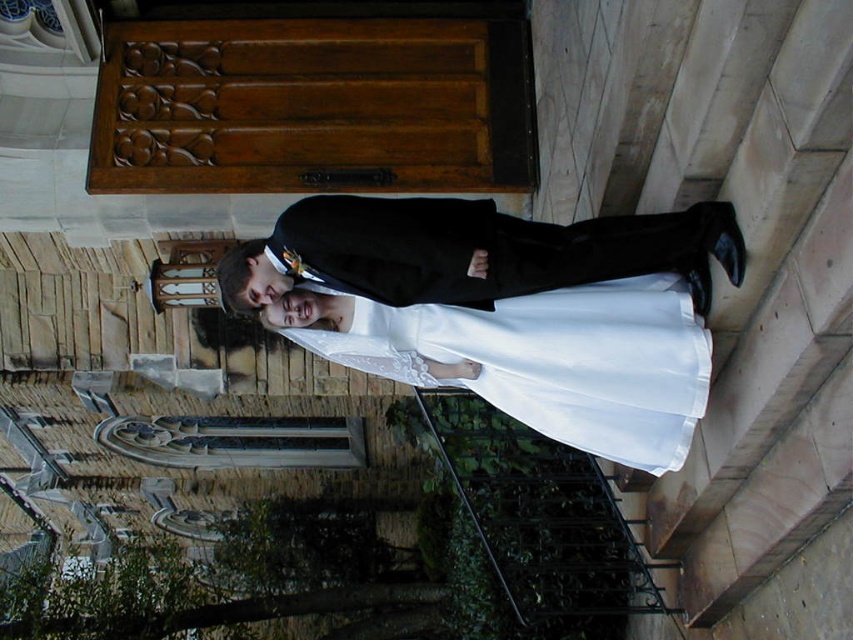
Is the position of satin white dress at center more distant than that of white satin dress at center?

Yes, it is.

Is satin white dress at center below white satin dress at center?

Yes, satin white dress at center is below white satin dress at center.

Does point (618, 378) come closer to viewer compared to point (346, 236)?

No, it is behind (346, 236).

The image size is (853, 640). Identify the location of satin white dress at center. (549, 360).